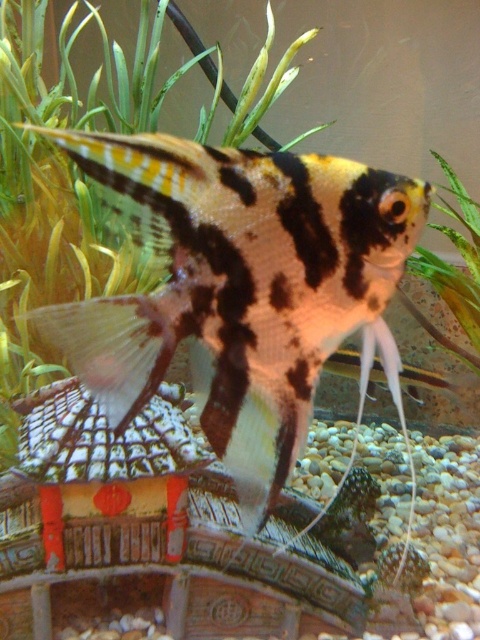
I want to click on black and white striped fish at center, so click(x=241, y=289).

Between black and white striped fish at center and green leafy plant at center, which one appears on the right side from the viewer's perspective?

green leafy plant at center is more to the right.

Does point (262, 220) lie behind point (445, 275)?

That is False.

You are a GUI agent. You are given a task and a screenshot of the screen. Output one action in this format:
    pyautogui.click(x=<x>, y=<y>)
    Task: Click on the black and white striped fish at center
    This screenshot has height=640, width=480.
    Given the screenshot: What is the action you would take?
    pyautogui.click(x=241, y=289)